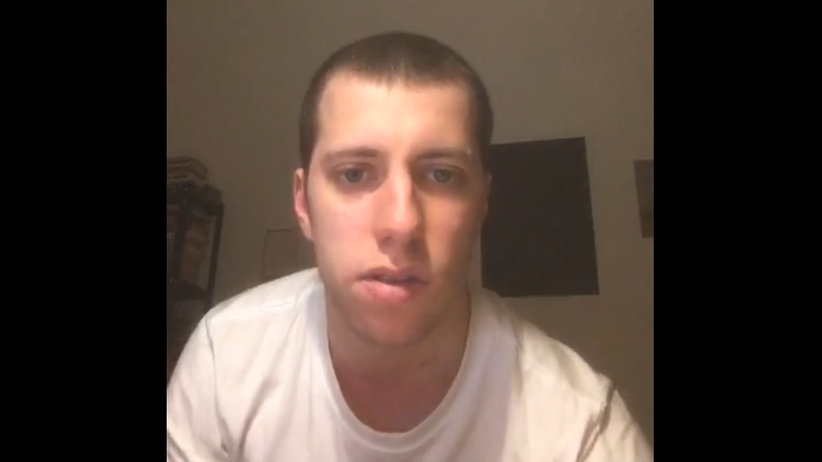
Image resolution: width=822 pixels, height=462 pixels. In order to click on pictures in this screenshot , I will do `click(530, 223)`, `click(644, 187)`.